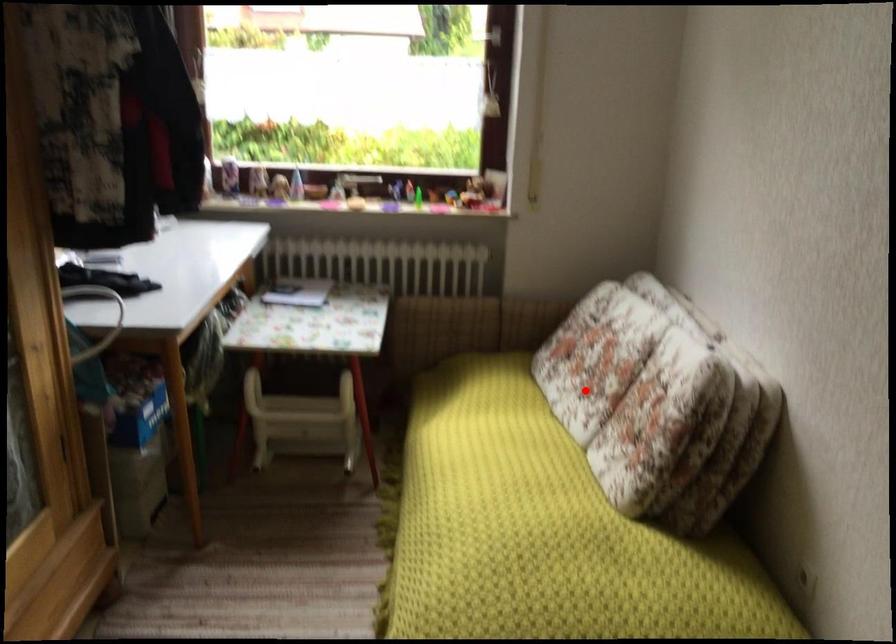
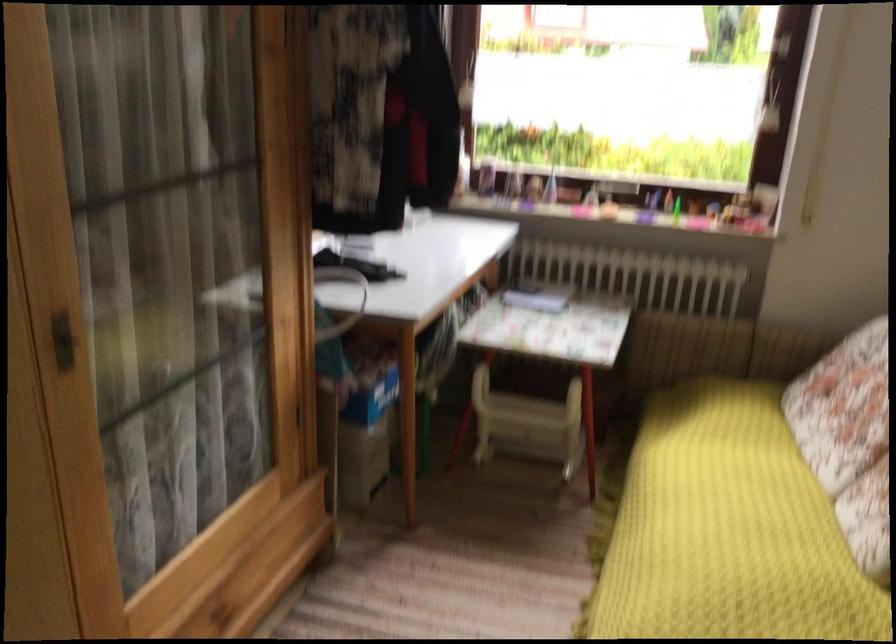
Locate, in the second image, the point that corresponds to the highlighted location in the first image.

(849, 439)